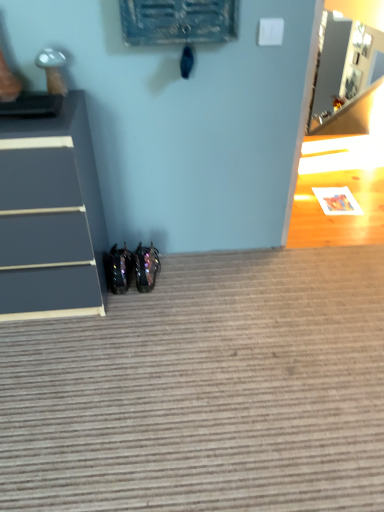
Question: From a real-world perspective, does matte gray chest of drawers at left sit lower than glossy black shoes at lower center, which is the 2th footwear from right to left?

Choices:
 (A) yes
 (B) no

Answer: (B)

Question: Is matte gray chest of drawers at left outside of glossy black shoes at lower center, which is the 2th footwear from right to left?

Choices:
 (A) no
 (B) yes

Answer: (B)

Question: From the image's perspective, is matte gray chest of drawers at left located above glossy black shoes at lower center, which is the 2th footwear from right to left?

Choices:
 (A) no
 (B) yes

Answer: (B)

Question: From a real-world perspective, is matte gray chest of drawers at left positioned over glossy black shoes at lower center, which is the 2th footwear from right to left, based on gravity?

Choices:
 (A) yes
 (B) no

Answer: (A)

Question: Is matte gray chest of drawers at left turned away from glossy black shoes at lower center, which is the 2th footwear from right to left?

Choices:
 (A) yes
 (B) no

Answer: (B)

Question: In the image, is glossy black shoes at lower center, which is the 2th footwear from right to left, on the left side or the right side of glossy metallic shoes at lower center, the 2th footwear in the left-to-right sequence?

Choices:
 (A) right
 (B) left

Answer: (B)

Question: Based on their sizes in the image, would you say glossy black shoes at lower center, which is the 2th footwear from right to left, is bigger or smaller than glossy metallic shoes at lower center, placed as the 1th footwear when sorted from right to left?

Choices:
 (A) big
 (B) small

Answer: (B)

Question: Considering the positions of glossy black shoes at lower center, which is counted as the 1th footwear, starting from the left, and glossy metallic shoes at lower center, placed as the 1th footwear when sorted from right to left, in the image, is glossy black shoes at lower center, which is counted as the 1th footwear, starting from the left, wider or thinner than glossy metallic shoes at lower center, placed as the 1th footwear when sorted from right to left,?

Choices:
 (A) thin
 (B) wide

Answer: (B)

Question: From the image's perspective, is glossy black shoes at lower center, which is counted as the 1th footwear, starting from the left, positioned above or below glossy metallic shoes at lower center, the 2th footwear in the left-to-right sequence?

Choices:
 (A) above
 (B) below

Answer: (B)

Question: Would you say glossy metallic shoes at lower center, the 2th footwear in the left-to-right sequence, is inside or outside textured gray carpet at lower center?

Choices:
 (A) inside
 (B) outside

Answer: (B)

Question: In terms of height, does glossy metallic shoes at lower center, the 2th footwear in the left-to-right sequence, look taller or shorter compared to textured gray carpet at lower center?

Choices:
 (A) tall
 (B) short

Answer: (A)

Question: From the image's perspective, is glossy metallic shoes at lower center, the 2th footwear in the left-to-right sequence, located above or below textured gray carpet at lower center?

Choices:
 (A) below
 (B) above

Answer: (B)

Question: From a real-world perspective, relative to textured gray carpet at lower center, is glossy metallic shoes at lower center, the 2th footwear in the left-to-right sequence, vertically above or below?

Choices:
 (A) below
 (B) above

Answer: (B)

Question: From the image's perspective, relative to glossy black shoes at lower center, which is counted as the 1th footwear, starting from the left, is glossy metallic shoes at lower center, the 2th footwear in the left-to-right sequence, above or below?

Choices:
 (A) above
 (B) below

Answer: (A)

Question: Is glossy metallic shoes at lower center, placed as the 1th footwear when sorted from right to left, wider or thinner than glossy black shoes at lower center, which is counted as the 1th footwear, starting from the left?

Choices:
 (A) thin
 (B) wide

Answer: (A)